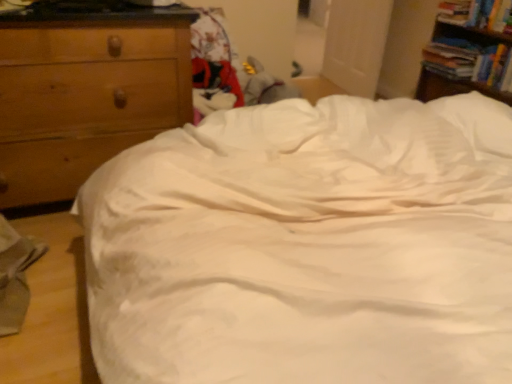
Question: From the image's perspective, is hardcover book at upper right, the first book positioned from the bottom, over wooden chest of drawers at left?

Choices:
 (A) yes
 (B) no

Answer: (A)

Question: Does hardcover book at upper right, marked as the 3th book in a top-to-bottom arrangement, have a lesser height compared to wooden chest of drawers at left?

Choices:
 (A) yes
 (B) no

Answer: (A)

Question: Considering the relative positions of hardcover book at upper right, the first book positioned from the bottom, and wooden chest of drawers at left in the image provided, is hardcover book at upper right, the first book positioned from the bottom, behind wooden chest of drawers at left?

Choices:
 (A) yes
 (B) no

Answer: (A)

Question: Is hardcover book at upper right, the first book positioned from the bottom, smaller than wooden chest of drawers at left?

Choices:
 (A) yes
 (B) no

Answer: (A)

Question: Is hardcover book at upper right, the first book positioned from the bottom, closer to camera compared to wooden chest of drawers at left?

Choices:
 (A) no
 (B) yes

Answer: (A)

Question: Does hardcover book at upper right, marked as the 3th book in a top-to-bottom arrangement, turn towards wooden chest of drawers at left?

Choices:
 (A) yes
 (B) no

Answer: (A)

Question: Is hardcover book at upper right, marked as the 1th book in a top-to-bottom arrangement, far away from white satin bed at center?

Choices:
 (A) no
 (B) yes

Answer: (B)

Question: From a real-world perspective, is hardcover book at upper right, marked as the 1th book in a top-to-bottom arrangement, positioned under white satin bed at center based on gravity?

Choices:
 (A) no
 (B) yes

Answer: (A)

Question: From a real-world perspective, is hardcover book at upper right, marked as the 1th book in a top-to-bottom arrangement, on white satin bed at center?

Choices:
 (A) no
 (B) yes

Answer: (B)

Question: From the image's perspective, would you say hardcover book at upper right, which is counted as the 3th book, starting from the bottom, is shown under white satin bed at center?

Choices:
 (A) no
 (B) yes

Answer: (A)

Question: Is hardcover book at upper right, marked as the 1th book in a top-to-bottom arrangement, next to white satin bed at center and touching it?

Choices:
 (A) yes
 (B) no

Answer: (B)

Question: Is white satin bed at center completely or partially inside hardcover book at upper right, marked as the 1th book in a top-to-bottom arrangement?

Choices:
 (A) no
 (B) yes

Answer: (A)

Question: From the image's perspective, is wooden chest of drawers at left on top of hardcover book at upper right, which is the second book from top to bottom?

Choices:
 (A) yes
 (B) no

Answer: (B)